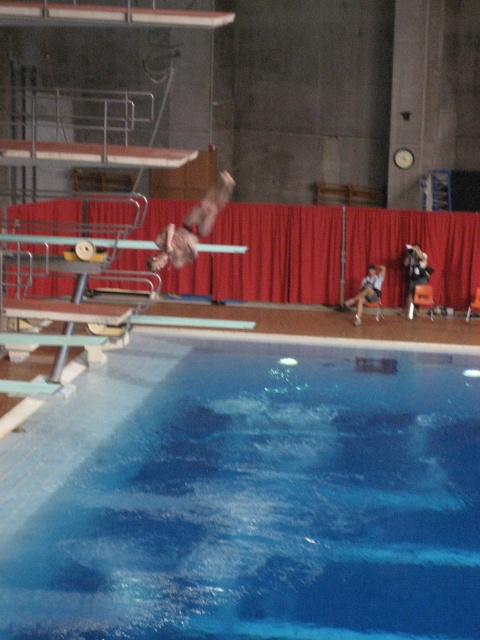
Question: Is blue smooth water at center closer to camera compared to brown leather jacket at center?

Choices:
 (A) yes
 (B) no

Answer: (A)

Question: Which object is the closest to the matte metal diving board at center?

Choices:
 (A) dark brown leather jacket at center
 (B) white fabric shirt at center

Answer: (B)

Question: Is red velvet curtain at center to the right of brown leather jacket at center from the viewer's perspective?

Choices:
 (A) no
 (B) yes

Answer: (B)

Question: Among these objects, which one is nearest to the camera?

Choices:
 (A) white fabric shirt at center
 (B) brown leather jacket at center
 (C) dark brown leather jacket at center

Answer: (B)

Question: Which point is farther to the camera?

Choices:
 (A) blue smooth water at center
 (B) red velvet curtain at center
 (C) matte metal diving board at center

Answer: (B)

Question: Can you confirm if dark brown leather jacket at center is positioned to the right of white fabric shirt at center?

Choices:
 (A) yes
 (B) no

Answer: (A)